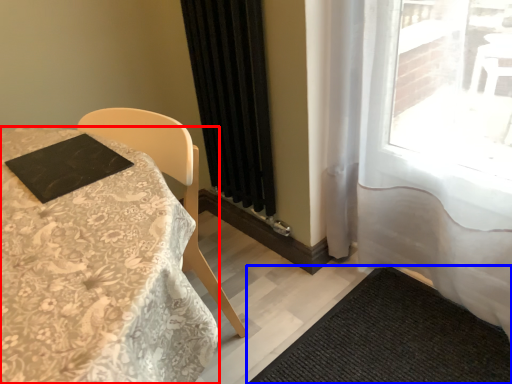
Question: Which of the following is the farthest to the observer, table (highlighted by a red box) or doormat (highlighted by a blue box)?

Choices:
 (A) table
 (B) doormat

Answer: (B)